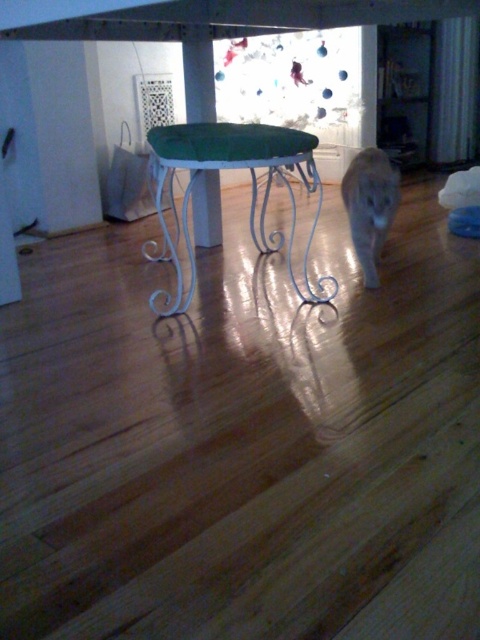
Which of these two, white wrought iron table at center or gray fur cat at center, stands shorter?

gray fur cat at center is shorter.

Identify the location of white wrought iron table at center. (251, 195).